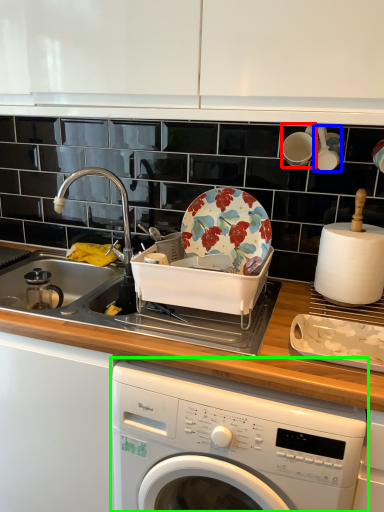
Question: Which is farther away from tableware (highlighted by a red box)? tableware (highlighted by a blue box) or washing machine (highlighted by a green box)?

Choices:
 (A) tableware
 (B) washing machine

Answer: (B)